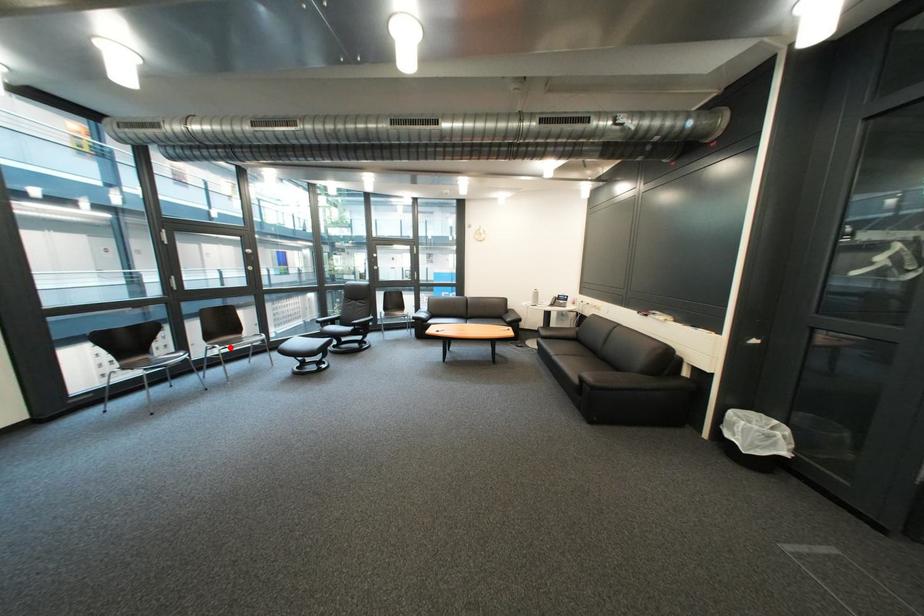
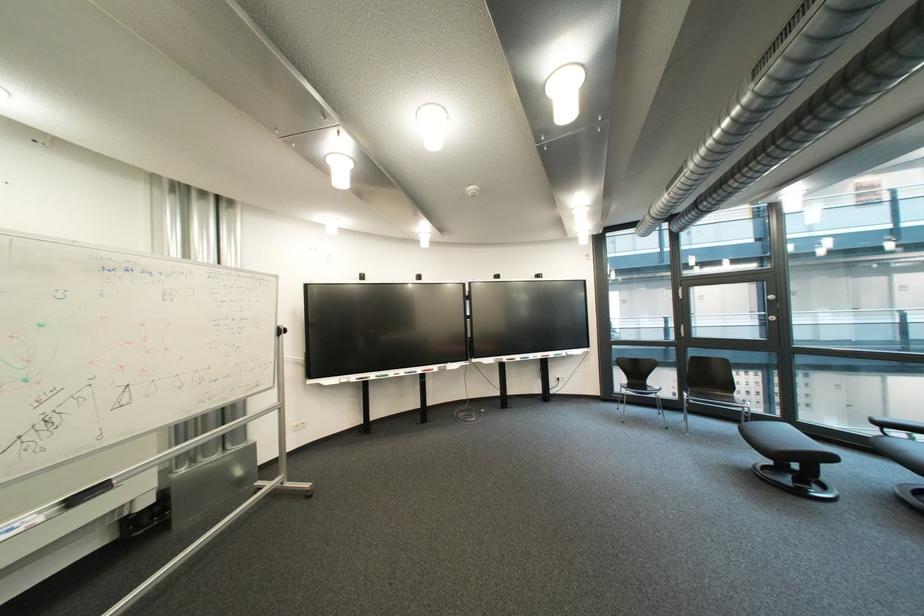
Question: I am providing you with two images of the same scene from different viewpoints. A red point is marked on the first image. Can you still see the location of the red point in image 2?

Choices:
 (A) Yes
 (B) No

Answer: (A)